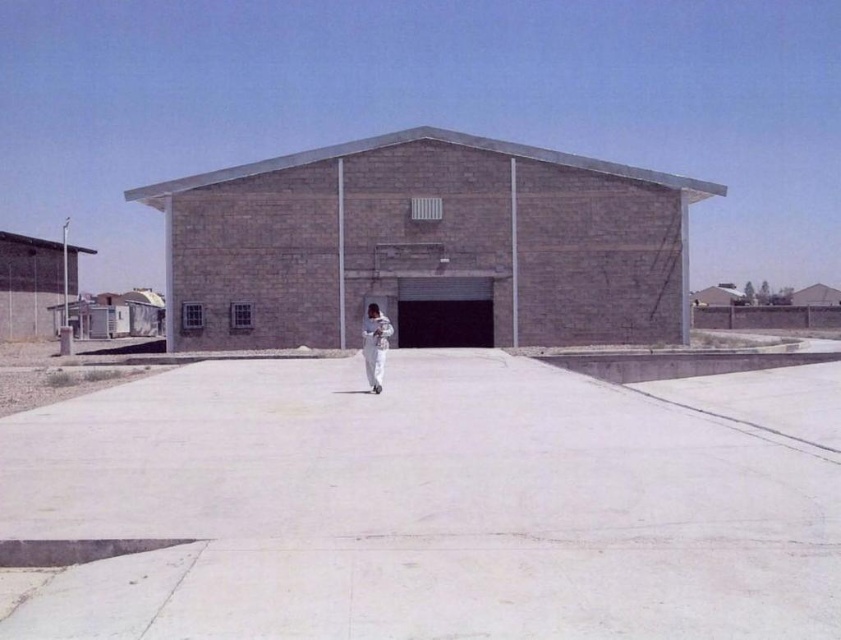
Question: Which point appears closest to the camera in this image?

Choices:
 (A) (374, 365)
 (B) (131, 442)

Answer: (B)

Question: Can you confirm if white concrete pavement at center is wider than white matte jumpsuit at center?

Choices:
 (A) yes
 (B) no

Answer: (A)

Question: Does white concrete pavement at center appear over white matte jumpsuit at center?

Choices:
 (A) no
 (B) yes

Answer: (A)

Question: Does white concrete pavement at center have a larger size compared to white matte jumpsuit at center?

Choices:
 (A) yes
 (B) no

Answer: (A)